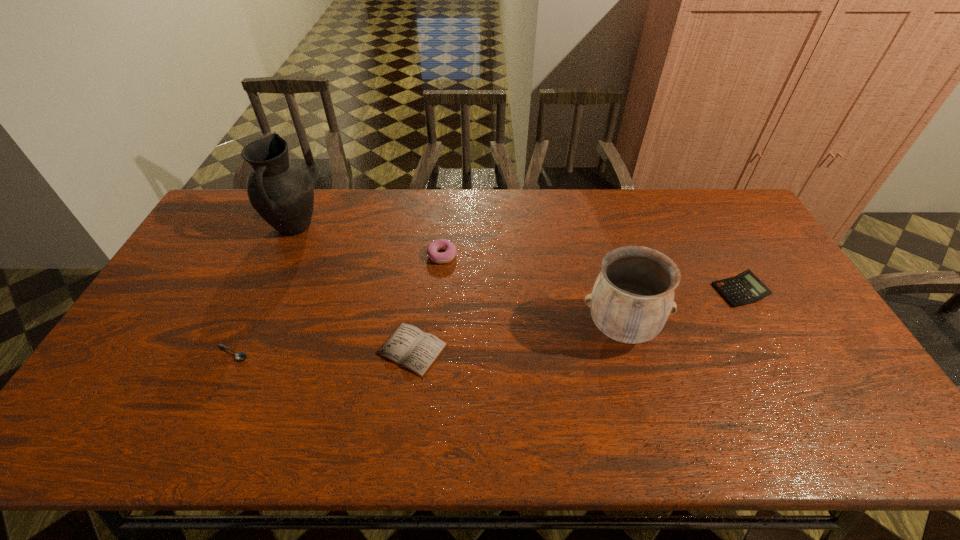
Where is `vacant position located 0.230m on the front of the calculator`? The width and height of the screenshot is (960, 540). vacant position located 0.230m on the front of the calculator is located at coordinates (787, 378).

Find the location of a particular element. This screenshot has height=540, width=960. free space located 0.120m on the front of the second shortest object is located at coordinates (402, 423).

At what (x,y) coordinates should I click in order to perform the action: click on vacant space located 0.360m on the back of the shortest object. Please return your answer as a coordinate pair (x, y). Looking at the image, I should click on (279, 253).

This screenshot has width=960, height=540. I want to click on object situated at the far edge, so click(282, 193).

This screenshot has height=540, width=960. I want to click on object located in the right edge section of the desktop, so click(x=745, y=288).

This screenshot has width=960, height=540. In the image, there is a desktop. What are the coordinates of `free space at the far edge` in the screenshot? It's located at (261, 227).

The image size is (960, 540). In order to click on free space at the near edge in this screenshot , I will do `click(166, 437)`.

Find the location of a particular element. The height and width of the screenshot is (540, 960). free space at the right edge is located at coordinates (832, 401).

At what (x,y) coordinates should I click in order to perform the action: click on free space at the far right corner of the desktop. Please return your answer as a coordinate pair (x, y). This screenshot has width=960, height=540. Looking at the image, I should click on (715, 215).

Image resolution: width=960 pixels, height=540 pixels. I want to click on vacant space at the near right corner of the desktop, so click(867, 449).